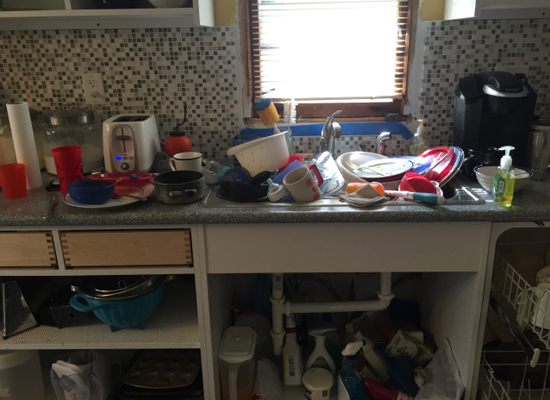
You are a GUI agent. You are given a task and a screenshot of the screen. Output one action in this format:
    pyautogui.click(x=<x>, y=<y>)
    Task: Click on the shelf
    
    Given the screenshot: What is the action you would take?
    pyautogui.click(x=184, y=333), pyautogui.click(x=44, y=12)